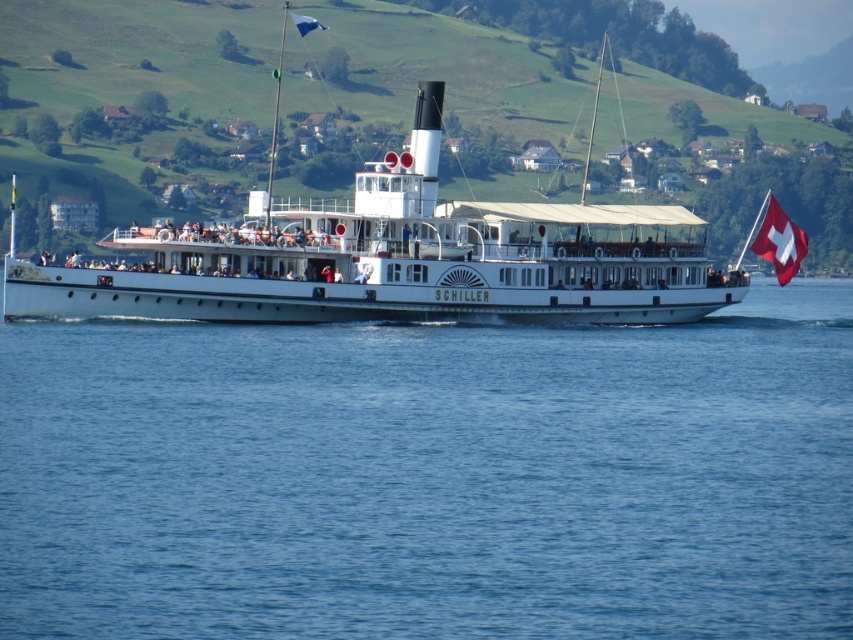
Can you confirm if white matte steamboat at center is positioned to the left of swiss flag at right?

Correct, you'll find white matte steamboat at center to the left of swiss flag at right.

Which of these two, white matte steamboat at center or swiss flag at right, stands shorter?

Standing shorter between the two is swiss flag at right.

Does point (51, 276) come closer to viewer compared to point (784, 275)?

That is True.

This screenshot has height=640, width=853. I want to click on white matte steamboat at center, so click(x=390, y=257).

Can you confirm if blue water at center is positioned above blue fabric flag at upper center?

Actually, blue water at center is below blue fabric flag at upper center.

Who is higher up, blue water at center or blue fabric flag at upper center?

blue fabric flag at upper center is higher up.

The height and width of the screenshot is (640, 853). What do you see at coordinates (431, 477) in the screenshot?
I see `blue water at center` at bounding box center [431, 477].

Where is `blue water at center`? The width and height of the screenshot is (853, 640). blue water at center is located at coordinates (431, 477).

Can you confirm if blue water at center is taller than swiss flag at right?

In fact, blue water at center may be shorter than swiss flag at right.

Is blue water at center positioned behind swiss flag at right?

No, blue water at center is closer to the viewer.

Measure the distance between point (474, 408) and camera.

A distance of 65.02 meters exists between point (474, 408) and camera.

Where is `blue water at center`? This screenshot has width=853, height=640. blue water at center is located at coordinates (431, 477).